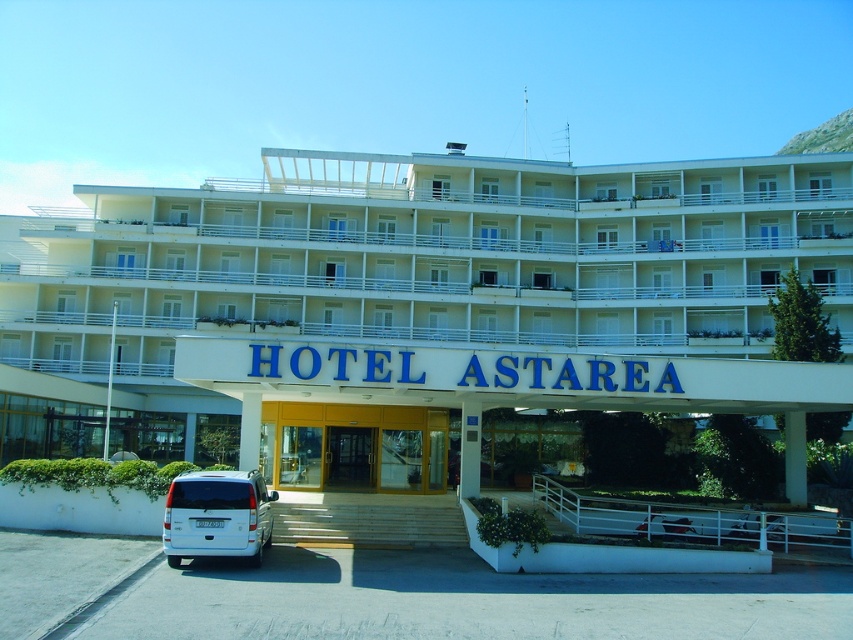
Between point (216, 531) and point (369, 445), which one is positioned in front?

Positioned in front is point (216, 531).

Who is more distant from viewer, (193, 536) or (352, 483)?

The point (352, 483) is more distant.

Find the location of a particular element. Image resolution: width=853 pixels, height=640 pixels. white matte van at lower left is located at coordinates (218, 515).

Is white glossy building at center shorter than white matte van at lower left?

Incorrect, white glossy building at center's height does not fall short of white matte van at lower left's.

Image resolution: width=853 pixels, height=640 pixels. What are the coordinates of `white glossy building at center` in the screenshot? It's located at (393, 289).

Which is below, white glossy building at center or wooden door at center?

Positioned lower is wooden door at center.

Can you confirm if white glossy building at center is wider than wooden door at center?

Correct, the width of white glossy building at center exceeds that of wooden door at center.

Which is behind, point (346, 216) or point (325, 465)?

Positioned behind is point (346, 216).

This screenshot has width=853, height=640. Identify the location of white glossy building at center. (393, 289).